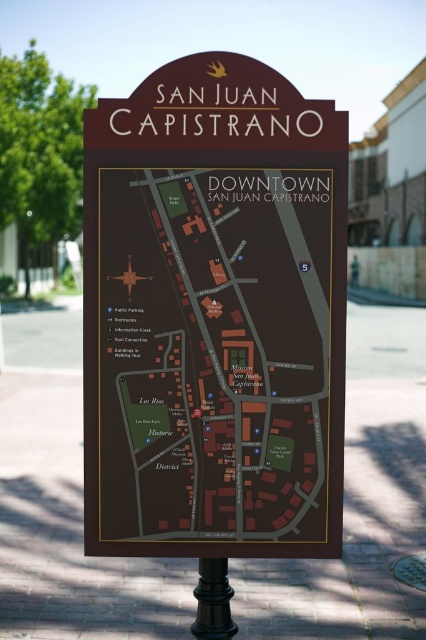
Is point (118, 378) more distant than point (230, 616)?

No, (118, 378) is closer to viewer.

Is point (178, 257) positioned before point (221, 614)?

Yes, it is in front of point (221, 614).

Locate an element on the screen. dark brown paper map at center is located at coordinates (213, 355).